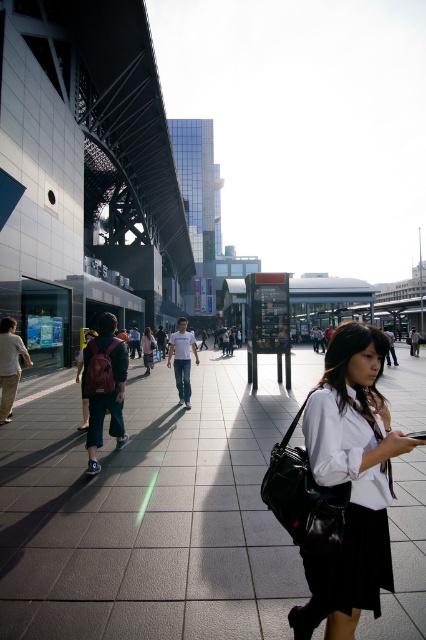
Question: Which is nearer to the white shirt at center?

Choices:
 (A) gray tile pavement at center
 (B) matte white shirt at center

Answer: (A)

Question: Which of the following is the farthest from the observer?

Choices:
 (A) white shirt at center
 (B) matte white shirt at center
 (C) gray tile pavement at center

Answer: (B)

Question: Which is farther from the gray tile pavement at center?

Choices:
 (A) white shirt at center
 (B) matte white shirt at center

Answer: (B)

Question: Does white shirt at center have a smaller size compared to matte white shirt at center?

Choices:
 (A) no
 (B) yes

Answer: (B)

Question: Does gray tile pavement at center appear under matte white shirt at center?

Choices:
 (A) yes
 (B) no

Answer: (A)

Question: Does white shirt at center have a lesser width compared to matte white shirt at center?

Choices:
 (A) yes
 (B) no

Answer: (A)